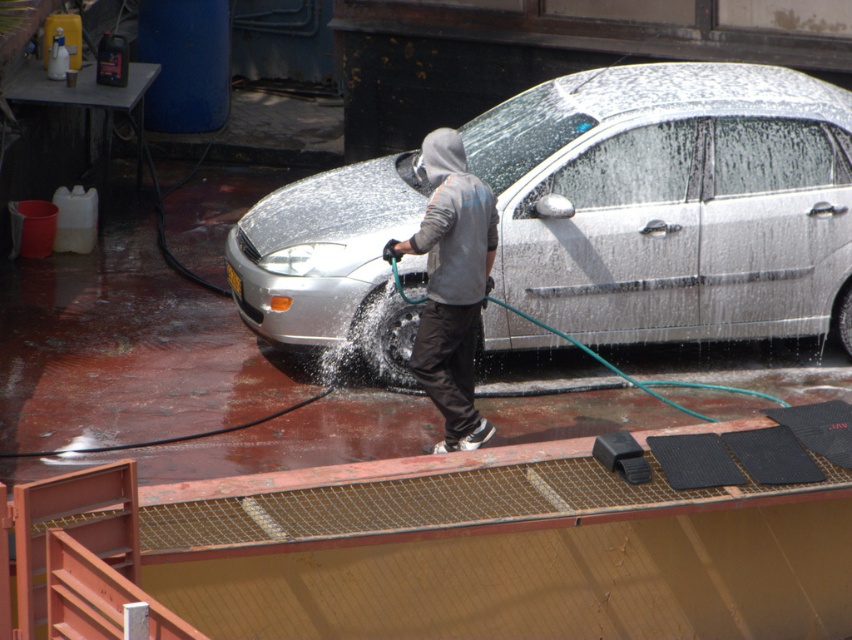
Who is lower down, silver metallic car at center or gray hoodie at center?

gray hoodie at center

Is silver metallic car at center shorter than gray hoodie at center?

No, silver metallic car at center is not shorter than gray hoodie at center.

Is point (674, 115) more distant than point (413, 248)?

Yes, it is.

At what (x,y) coordinates should I click in order to perform the action: click on silver metallic car at center. Please return your answer as a coordinate pair (x, y). This screenshot has height=640, width=852. Looking at the image, I should click on (672, 202).